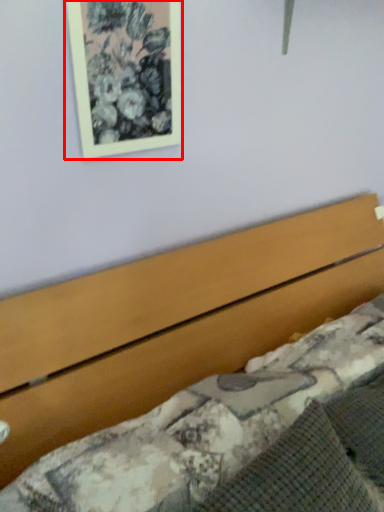
Question: From the image's perspective, what is the correct spatial positioning of picture frame (annotated by the red box) in reference to bed?

Choices:
 (A) above
 (B) below

Answer: (A)